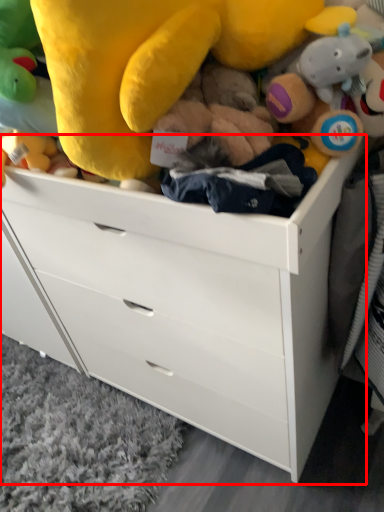
Question: From the image's perspective, what is the correct spatial positioning of chest of drawers (annotated by the red box) in reference to toy?

Choices:
 (A) above
 (B) below

Answer: (B)